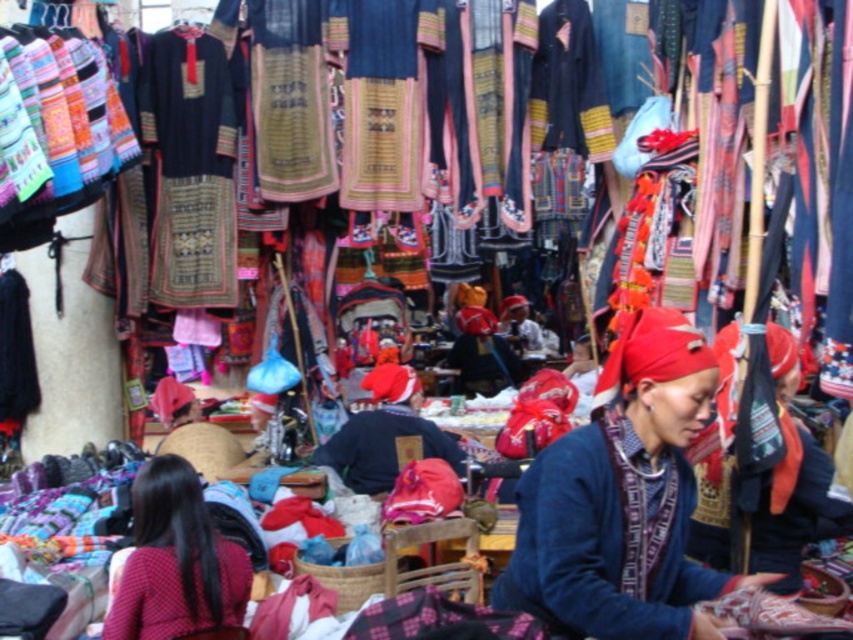
What are the coordinates of the blue woven sweater at center?

The blue woven sweater at center is located at coordinates point [606,538].

You are a customer in the market and want to buy both the blue woven sweater at center and the dark blue fabric at center. If you are standing at the entrance of the market, which item would you need to walk further to reach?

The blue woven sweater at center is 10.36 feet away from the dark blue fabric at center. Since they are both at the center of the image, their distance from the entrance isn

Consider the image. You are a customer at the market and want to buy a textile item. You notice the blue woven sweater at center and the red fabric headscarf at lower left. Which item is wider?

The blue woven sweater at center is wider than the red fabric headscarf at lower left.